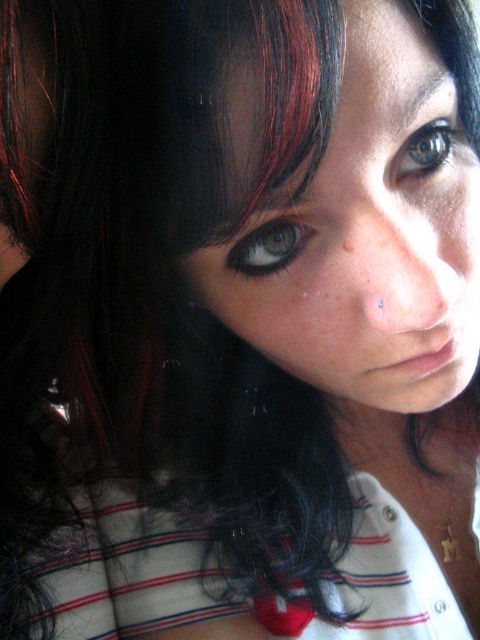
Is matte green eye at center closer to camera compared to brown matte freckle at center?

No, matte green eye at center is further to the viewer.

Is point (296, 228) more distant than point (342, 244)?

That is True.

Does point (286, 257) come closer to viewer compared to point (346, 248)?

No.

You are a GUI agent. You are given a task and a screenshot of the screen. Output one action in this format:
    pyautogui.click(x=<x>, y=<y>)
    Task: Click on the matte green eye at center
    Image resolution: width=480 pixels, height=640 pixels.
    Given the screenshot: What is the action you would take?
    pyautogui.click(x=268, y=246)

Which is behind, point (300, 240) or point (418, 164)?

Point (418, 164)

Is matte green eye at center in front of green matte eye at upper center?

No, matte green eye at center is further to the viewer.

This screenshot has width=480, height=640. Find the location of `matte green eye at center`. matte green eye at center is located at coordinates (268, 246).

Can you confirm if matte skin face at center is bigger than brown matte freckle at center?

Correct, matte skin face at center is larger in size than brown matte freckle at center.

What do you see at coordinates (365, 240) in the screenshot?
I see `matte skin face at center` at bounding box center [365, 240].

Is point (336, 349) positioned after point (349, 237)?

Yes, point (336, 349) is behind point (349, 237).

This screenshot has height=640, width=480. Find the location of `matte skin face at center`. matte skin face at center is located at coordinates (365, 240).